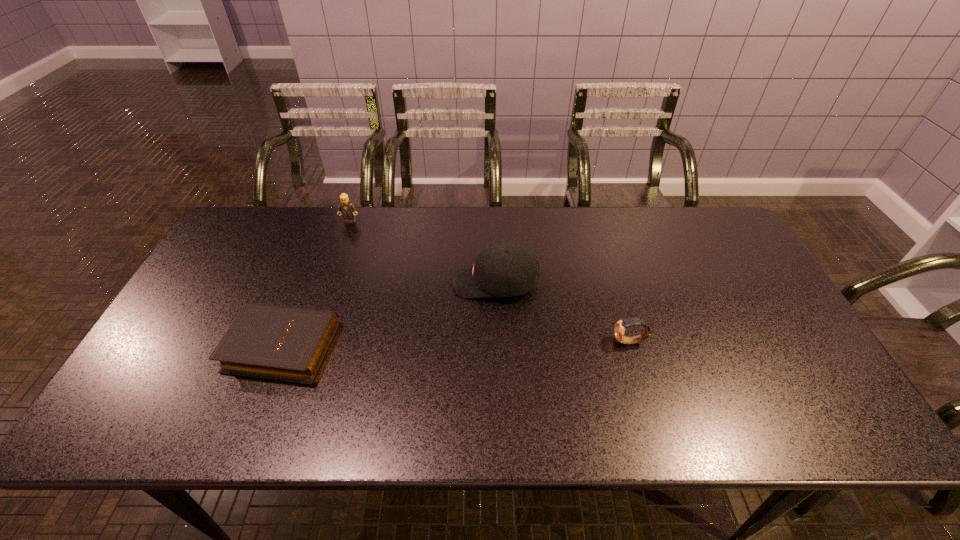
I want to click on object that ranks as the closest to the third shortest object, so click(x=502, y=270).